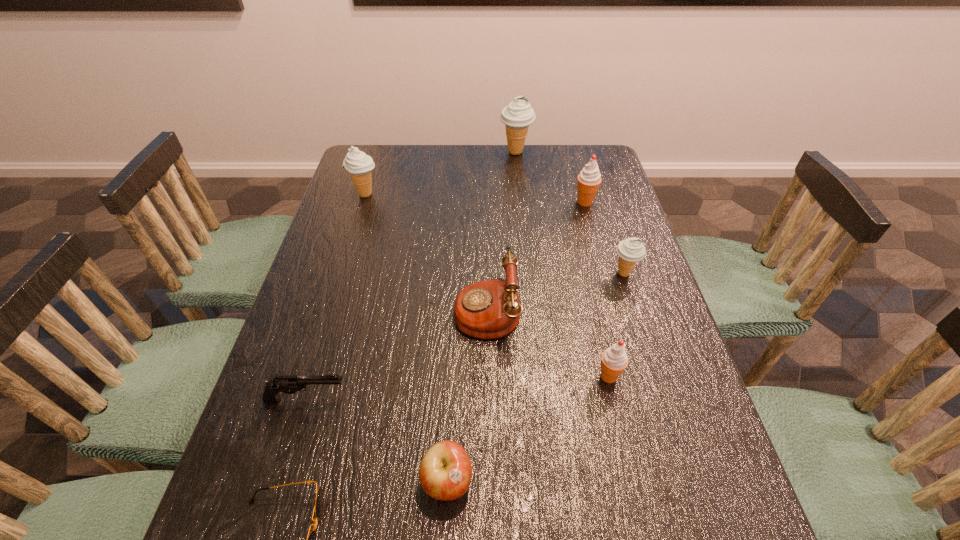
Identify the location of the biggest beige icecream. (518, 115).

Locate an element on the screen. The height and width of the screenshot is (540, 960). the tallest icecream is located at coordinates (518, 115).

In order to click on the second biggest beige icecream in this screenshot , I will do `click(359, 165)`.

Identify the location of the leftmost beige icecream. This screenshot has width=960, height=540. (359, 165).

You are a GUI agent. You are given a task and a screenshot of the screen. Output one action in this format:
    pyautogui.click(x=<x>, y=<y>)
    Task: Click on the bigger red icecream
    Image resolution: width=960 pixels, height=540 pixels.
    Given the screenshot: What is the action you would take?
    pyautogui.click(x=589, y=179)

This screenshot has width=960, height=540. In order to click on telephone in this screenshot , I will do `click(489, 309)`.

Locate an element on the screen. This screenshot has width=960, height=540. the sixth farthest object is located at coordinates tap(614, 360).

I want to click on the nearer red icecream, so click(x=614, y=360).

Locate an element on the screen. Image resolution: width=960 pixels, height=540 pixels. the second nearest icecream is located at coordinates (630, 251).

The width and height of the screenshot is (960, 540). Find the location of `the rightmost beige icecream`. the rightmost beige icecream is located at coordinates (630, 251).